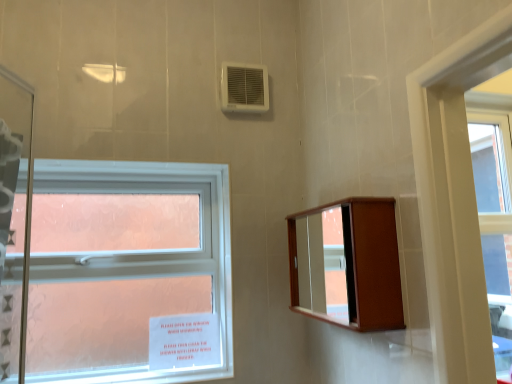
Question: Is clear glass window at left inside wooden medicine cabinet at upper right?

Choices:
 (A) no
 (B) yes

Answer: (A)

Question: Can you confirm if wooden medicine cabinet at upper right is taller than clear glass window at left?

Choices:
 (A) no
 (B) yes

Answer: (A)

Question: Considering the relative sizes of wooden medicine cabinet at upper right and clear glass window at left in the image provided, is wooden medicine cabinet at upper right bigger than clear glass window at left?

Choices:
 (A) no
 (B) yes

Answer: (A)

Question: Are wooden medicine cabinet at upper right and clear glass window at left located far from each other?

Choices:
 (A) no
 (B) yes

Answer: (A)

Question: Is wooden medicine cabinet at upper right not within clear glass window at left?

Choices:
 (A) yes
 (B) no

Answer: (A)

Question: Considering their positions, is clear glass window at left located in front of or behind white plastic air conditioning unit at upper center?

Choices:
 (A) behind
 (B) front

Answer: (B)

Question: Is point (39, 167) closer or farther from the camera than point (224, 109)?

Choices:
 (A) closer
 (B) farther

Answer: (A)

Question: Is clear glass window at left situated inside white plastic air conditioning unit at upper center or outside?

Choices:
 (A) inside
 (B) outside

Answer: (B)

Question: Looking at the image, does clear glass window at left seem bigger or smaller compared to white plastic air conditioning unit at upper center?

Choices:
 (A) big
 (B) small

Answer: (A)

Question: Visually, is wooden medicine cabinet at upper right positioned to the left or to the right of clear glass window at left?

Choices:
 (A) left
 (B) right

Answer: (B)

Question: Is wooden medicine cabinet at upper right taller or shorter than clear glass window at left?

Choices:
 (A) tall
 (B) short

Answer: (B)

Question: From the image's perspective, is wooden medicine cabinet at upper right located above or below clear glass window at left?

Choices:
 (A) below
 (B) above

Answer: (B)

Question: Is wooden medicine cabinet at upper right wider or thinner than clear glass window at left?

Choices:
 (A) thin
 (B) wide

Answer: (B)

Question: Is point (344, 261) positioned closer to the camera than point (233, 99)?

Choices:
 (A) farther
 (B) closer

Answer: (B)

Question: Considering the positions of wooden medicine cabinet at upper right and white plastic air conditioning unit at upper center in the image, is wooden medicine cabinet at upper right bigger or smaller than white plastic air conditioning unit at upper center?

Choices:
 (A) big
 (B) small

Answer: (A)